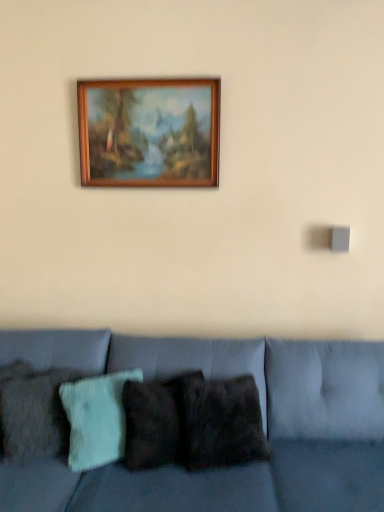
The image size is (384, 512). I want to click on wooden picture frame at upper center, so click(x=149, y=132).

Describe the element at coordinates (177, 468) in the screenshot. This screenshot has width=384, height=512. I see `velvet blue couch at lower center` at that location.

Find the location of a particular element. This screenshot has width=384, height=512. dark brown textured pillow at center, which is the third pillow in left-to-right order is located at coordinates (220, 422).

The image size is (384, 512). Find the location of `wooden picture frame at upper center`. wooden picture frame at upper center is located at coordinates (149, 132).

Is textured woolen pillow at left, acting as the third pillow starting from the right, taller or shorter than wooden picture frame at upper center?

In the image, textured woolen pillow at left, acting as the third pillow starting from the right, appears to be shorter than wooden picture frame at upper center.

At what (x,y) coordinates should I click in order to perform the action: click on picture frame behind the textured woolen pillow at left, positioned as the 1th pillow in left-to-right order. Please return your answer as a coordinate pair (x, y). Image resolution: width=384 pixels, height=512 pixels. Looking at the image, I should click on coord(149,132).

From the image's perspective, is textured woolen pillow at left, positioned as the 1th pillow in left-to-right order, above or below wooden picture frame at upper center?

textured woolen pillow at left, positioned as the 1th pillow in left-to-right order, is below wooden picture frame at upper center.

Where is `studio couch in front of the wooden picture frame at upper center`? The height and width of the screenshot is (512, 384). studio couch in front of the wooden picture frame at upper center is located at coordinates (177, 468).

Which of these two, velvet blue couch at lower center or wooden picture frame at upper center, is thinner?

wooden picture frame at upper center.

Is velvet blue couch at lower center facing away from wooden picture frame at upper center?

velvet blue couch at lower center is not turned away from wooden picture frame at upper center.

Does velvet blue couch at lower center have a lesser height compared to wooden picture frame at upper center?

No.

Is point (33, 417) positioned behind point (215, 385)?

No, (33, 417) is closer to viewer.

Is textured woolen pillow at left, positioned as the 1th pillow in left-to-right order, shorter than dark brown textured pillow at center, placed as the 1th pillow when sorted from right to left?

No, textured woolen pillow at left, positioned as the 1th pillow in left-to-right order, is not shorter than dark brown textured pillow at center, placed as the 1th pillow when sorted from right to left.

Considering the relative positions of textured woolen pillow at left, acting as the third pillow starting from the right, and dark brown textured pillow at center, which is the third pillow in left-to-right order, in the image provided, is textured woolen pillow at left, acting as the third pillow starting from the right, to the left or to the right of dark brown textured pillow at center, which is the third pillow in left-to-right order,?

In the image, textured woolen pillow at left, acting as the third pillow starting from the right, appears on the left side of dark brown textured pillow at center, which is the third pillow in left-to-right order.

From the image's perspective, who appears lower, dark brown textured pillow at center, placed as the 1th pillow when sorted from right to left, or textured woolen pillow at left, positioned as the 1th pillow in left-to-right order?

dark brown textured pillow at center, placed as the 1th pillow when sorted from right to left, is shown below in the image.

Which is behind, dark brown textured pillow at center, placed as the 1th pillow when sorted from right to left, or textured woolen pillow at left, acting as the third pillow starting from the right?

dark brown textured pillow at center, placed as the 1th pillow when sorted from right to left.

Does point (180, 388) come farther from viewer compared to point (4, 369)?

That is False.

Does textured teal pillow at center, the 2th pillow in the right-to-left sequence, turn towards wooden picture frame at upper center?

No, textured teal pillow at center, the 2th pillow in the right-to-left sequence, is not facing towards wooden picture frame at upper center.

Considering the positions of point (76, 426) and point (200, 79), is point (76, 426) closer or farther from the camera than point (200, 79)?

Point (76, 426) is positioned closer to the camera compared to point (200, 79).

From the wooden picture frame at upper center, count the 1st pillow to the left and point to it. Please provide its 2D coordinates.

[(96, 419)]

Does textured teal pillow at center, which appears as the second pillow when viewed from the left, have a greater height compared to wooden picture frame at upper center?

Incorrect, the height of textured teal pillow at center, which appears as the second pillow when viewed from the left, is not larger of that of wooden picture frame at upper center.

Is point (169, 104) positioned in front of point (275, 443)?

That is False.

Looking at their sizes, would you say wooden picture frame at upper center is wider or thinner than velvet blue couch at lower center?

Clearly, wooden picture frame at upper center has less width compared to velvet blue couch at lower center.

From the image's perspective, is wooden picture frame at upper center on top of velvet blue couch at lower center?

Yes, from the image's perspective, wooden picture frame at upper center is over velvet blue couch at lower center.

Does wooden picture frame at upper center have a lesser height compared to velvet blue couch at lower center?

Correct, wooden picture frame at upper center is not as tall as velvet blue couch at lower center.

Considering the sizes of objects wooden picture frame at upper center and textured woolen pillow at left, positioned as the 1th pillow in left-to-right order, in the image provided, who is wider, wooden picture frame at upper center or textured woolen pillow at left, positioned as the 1th pillow in left-to-right order,?

textured woolen pillow at left, positioned as the 1th pillow in left-to-right order.

Is wooden picture frame at upper center spatially inside textured woolen pillow at left, positioned as the 1th pillow in left-to-right order, or outside of it?

wooden picture frame at upper center cannot be found inside textured woolen pillow at left, positioned as the 1th pillow in left-to-right order.

Which is more to the left, wooden picture frame at upper center or textured woolen pillow at left, acting as the third pillow starting from the right?

Positioned to the left is textured woolen pillow at left, acting as the third pillow starting from the right.

From the picture: How many degrees apart are the facing directions of wooden picture frame at upper center and textured woolen pillow at left, acting as the third pillow starting from the right?

16.9 degrees.

Locate an element on the screen. The height and width of the screenshot is (512, 384). picture frame above the textured woolen pillow at left, acting as the third pillow starting from the right (from a real-world perspective) is located at coordinates (149, 132).

This screenshot has width=384, height=512. In order to click on picture frame above the velvet blue couch at lower center (from the image's perspective) in this screenshot , I will do `click(149, 132)`.

Looking at the image, which one is located further to velvet blue couch at lower center, dark brown textured pillow at center, which is the third pillow in left-to-right order, or textured woolen pillow at left, acting as the third pillow starting from the right?

textured woolen pillow at left, acting as the third pillow starting from the right.

Considering their positions, is wooden picture frame at upper center positioned further to velvet blue couch at lower center than textured teal pillow at center, which appears as the second pillow when viewed from the left?

The object further to velvet blue couch at lower center is wooden picture frame at upper center.

From the image, which object appears to be farther from dark brown textured pillow at center, placed as the 1th pillow when sorted from right to left, textured teal pillow at center, the 2th pillow in the right-to-left sequence, or velvet blue couch at lower center?

Among the two, textured teal pillow at center, the 2th pillow in the right-to-left sequence, is located further to dark brown textured pillow at center, placed as the 1th pillow when sorted from right to left.

Looking at the image, which one is located further to velvet blue couch at lower center, textured woolen pillow at left, acting as the third pillow starting from the right, or wooden picture frame at upper center?

Based on the image, wooden picture frame at upper center appears to be further to velvet blue couch at lower center.

From the image, which object appears to be farther from textured woolen pillow at left, acting as the third pillow starting from the right, dark brown textured pillow at center, placed as the 1th pillow when sorted from right to left, or wooden picture frame at upper center?

→ wooden picture frame at upper center is further to textured woolen pillow at left, acting as the third pillow starting from the right.

When comparing their distances from dark brown textured pillow at center, which is the third pillow in left-to-right order, does velvet blue couch at lower center or textured teal pillow at center, which appears as the second pillow when viewed from the left, seem further?

The object further to dark brown textured pillow at center, which is the third pillow in left-to-right order, is textured teal pillow at center, which appears as the second pillow when viewed from the left.

Considering their positions, is textured teal pillow at center, the 2th pillow in the right-to-left sequence, positioned closer to velvet blue couch at lower center than wooden picture frame at upper center?

Based on the image, textured teal pillow at center, the 2th pillow in the right-to-left sequence, appears to be nearer to velvet blue couch at lower center.

Estimate the real-world distances between objects in this image. Which object is further from dark brown textured pillow at center, placed as the 1th pillow when sorted from right to left, wooden picture frame at upper center or velvet blue couch at lower center?

wooden picture frame at upper center is further to dark brown textured pillow at center, placed as the 1th pillow when sorted from right to left.

Find the location of `pillow between textured woolen pillow at left, acting as the third pillow starting from the right, and dark brown textured pillow at center, placed as the 1th pillow when sorted from right to left, from left to right`. pillow between textured woolen pillow at left, acting as the third pillow starting from the right, and dark brown textured pillow at center, placed as the 1th pillow when sorted from right to left, from left to right is located at coordinates (96, 419).

At what (x,y) coordinates should I click in order to perform the action: click on pillow between velvet blue couch at lower center and dark brown textured pillow at center, which is the third pillow in left-to-right order, along the z-axis. Please return your answer as a coordinate pair (x, y). Image resolution: width=384 pixels, height=512 pixels. Looking at the image, I should click on (33, 412).

Locate an element on the screen. pillow between wooden picture frame at upper center and textured teal pillow at center, the 2th pillow in the right-to-left sequence, from top to bottom is located at coordinates (33, 412).